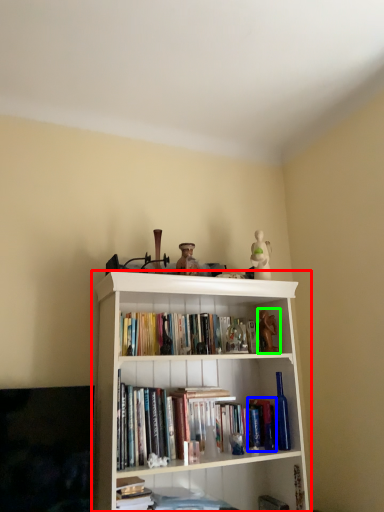
Question: Which object is positioned farthest from bookcase (highlighted by a red box)? Select from paperback book (highlighted by a blue box) and toy (highlighted by a green box).

Choices:
 (A) paperback book
 (B) toy

Answer: (B)